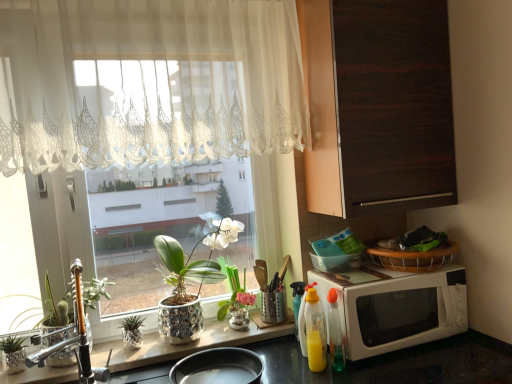
The height and width of the screenshot is (384, 512). I want to click on vacant area to the right of translucent glass pineapple at lower center, the 3th houseplant from the left, so click(x=168, y=346).